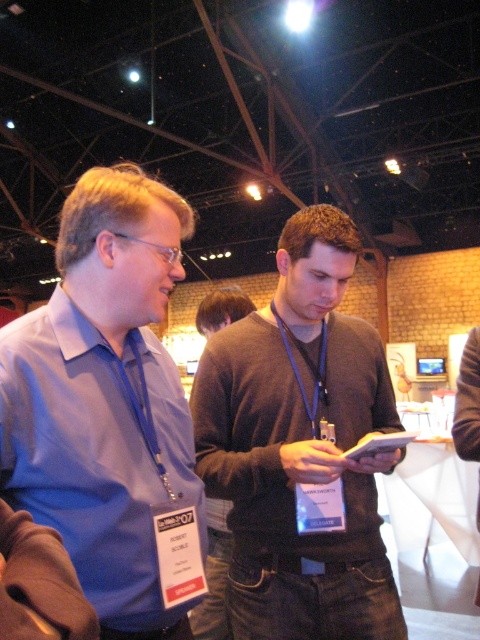
Question: Estimate the real-world distances between objects in this image. Which object is closer to the matte blue shirt at left?

Choices:
 (A) dark brown sweater at center
 (B) dark gray sweater at center

Answer: (A)

Question: Considering the relative positions of dark brown sweater at center and dark gray sweater at center in the image provided, where is dark brown sweater at center located with respect to dark gray sweater at center?

Choices:
 (A) below
 (B) above

Answer: (B)

Question: Which point is farther from the camera taking this photo?

Choices:
 (A) (117, 609)
 (B) (216, 538)
 (C) (347, 548)

Answer: (B)

Question: In this image, where is matte blue shirt at left located relative to dark gray sweater at center?

Choices:
 (A) above
 (B) below

Answer: (A)

Question: Is matte blue shirt at left to the right of dark gray sweater at center from the viewer's perspective?

Choices:
 (A) no
 (B) yes

Answer: (A)

Question: Which point is farther to the camera?

Choices:
 (A) dark gray sweater at center
 (B) dark brown sweater at center
 (C) matte blue shirt at left

Answer: (B)